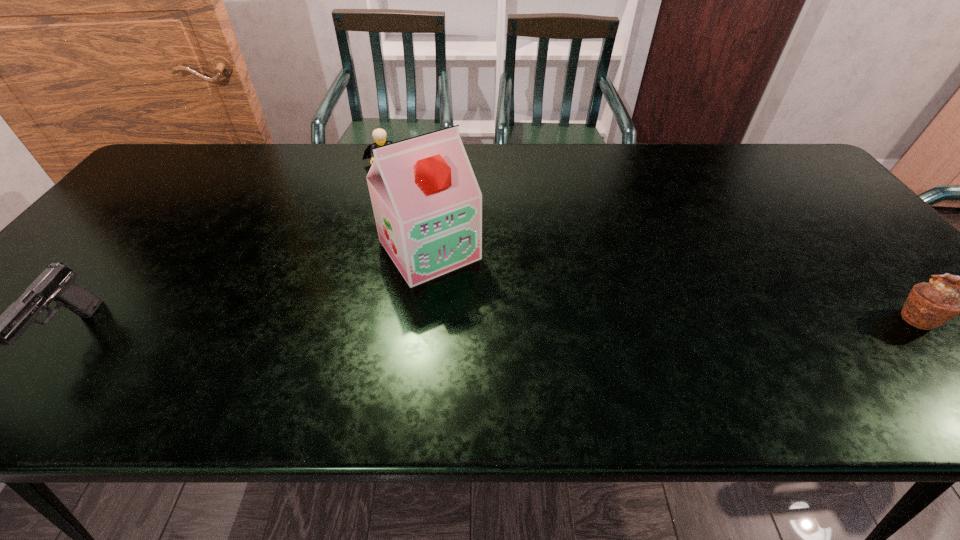
Locate an element on the screen. The image size is (960, 540). blank area located 0.200m with the cap open on the second farthest object is located at coordinates click(499, 342).

The height and width of the screenshot is (540, 960). Find the location of `free point located with the cap open on the second farthest object`. free point located with the cap open on the second farthest object is located at coordinates (499, 342).

Where is `object at the far edge`? object at the far edge is located at coordinates (379, 135).

In order to click on pistol that is at the near edge in this screenshot , I will do (56, 283).

Find the location of a particular element. This screenshot has height=540, width=960. muffin present at the near edge is located at coordinates click(x=929, y=305).

You are a GUI agent. You are given a task and a screenshot of the screen. Output one action in this format:
    pyautogui.click(x=<x>, y=<y>)
    Task: Click on the object at the left edge
    The height and width of the screenshot is (540, 960).
    Given the screenshot: What is the action you would take?
    pyautogui.click(x=56, y=283)

This screenshot has width=960, height=540. In order to click on object positioned at the right edge in this screenshot , I will do `click(929, 305)`.

Find the location of `object located at the near left corner`. object located at the near left corner is located at coordinates (56, 283).

I want to click on object present at the near right corner, so click(x=929, y=305).

In order to click on free space at the far edge of the desktop in this screenshot , I will do `click(324, 183)`.